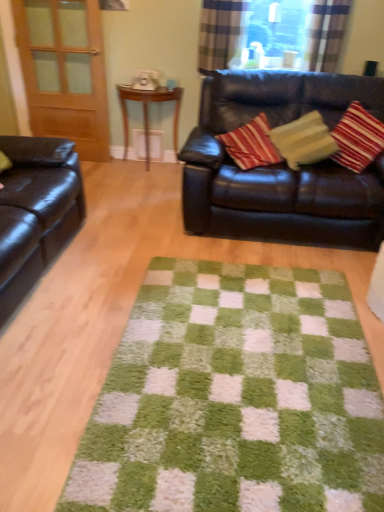
Question: Is shiny black leather couch at upper right, the second studio couch in the left-to-right sequence, spatially inside transparent glass window at upper center, or outside of it?

Choices:
 (A) outside
 (B) inside

Answer: (A)

Question: Relative to transparent glass window at upper center, is shiny black leather couch at upper right, placed as the 1th studio couch when sorted from right to left, in front or behind?

Choices:
 (A) behind
 (B) front

Answer: (B)

Question: Which object is positioned farthest from the white matte square at center?

Choices:
 (A) wooden side table at center
 (B) transparent glass window at upper center
 (C) green shaggy rug at center
 (D) plaid fabric curtain at upper center, the 1th curtain when ordered from right to left
 (E) shiny black leather couch at upper right, placed as the 1th studio couch when sorted from right to left

Answer: (C)

Question: Estimate the real-world distances between objects in this image. Which object is closer to the matte wood screen door at left?

Choices:
 (A) shiny brown leather couch at left, acting as the second studio couch starting from the right
 (B) green shaggy rug at center
 (C) white matte square at center
 (D) transparent glass window at upper center
 (E) plaid fabric curtain at upper center, the 1th curtain when ordered from right to left

Answer: (C)